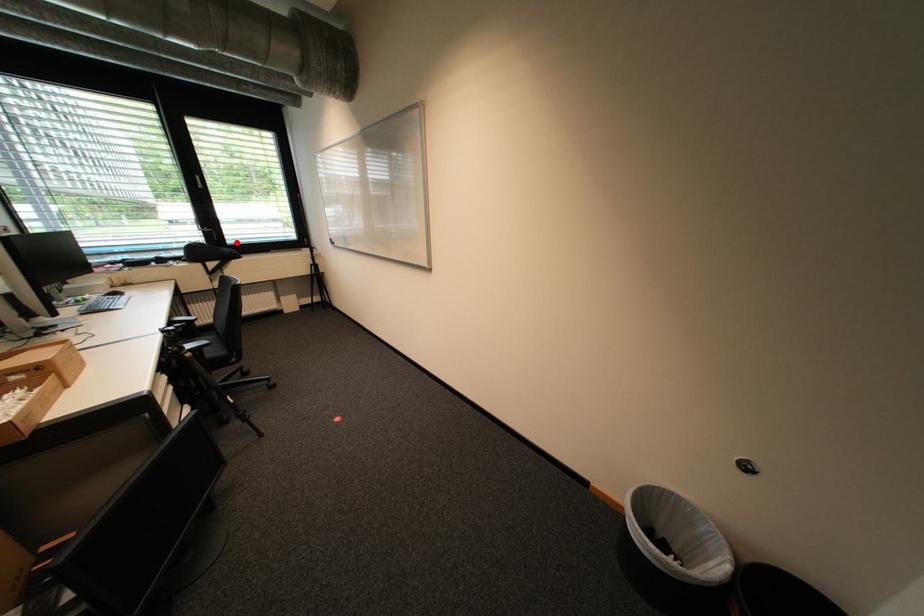
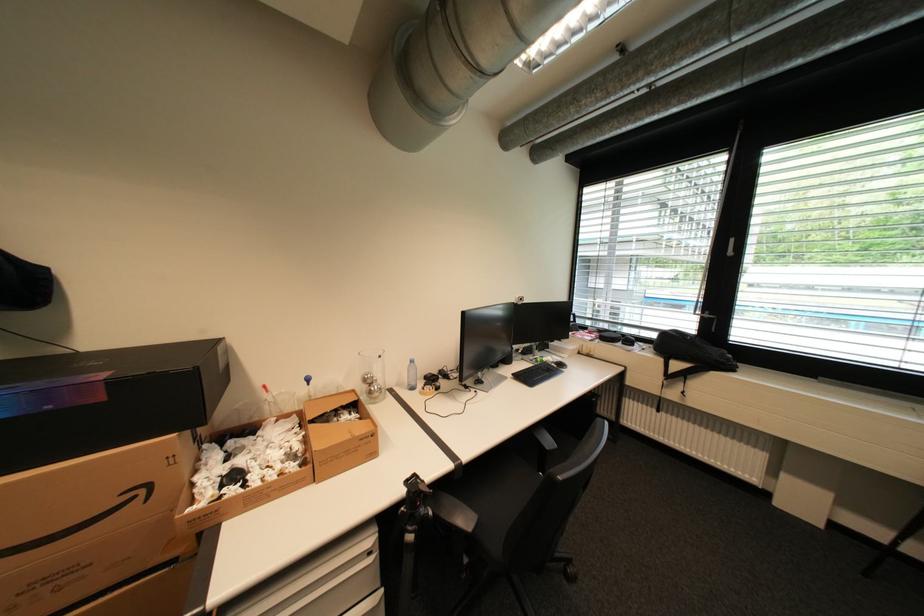
Question: I am providing you with two images of the same scene from different viewpoints. Image1 has a red point marked. In image2, the corresponding 3D location appears at what relative position? Reply with the corresponding letter.

Choices:
 (A) Closer
 (B) Farther

Answer: (B)